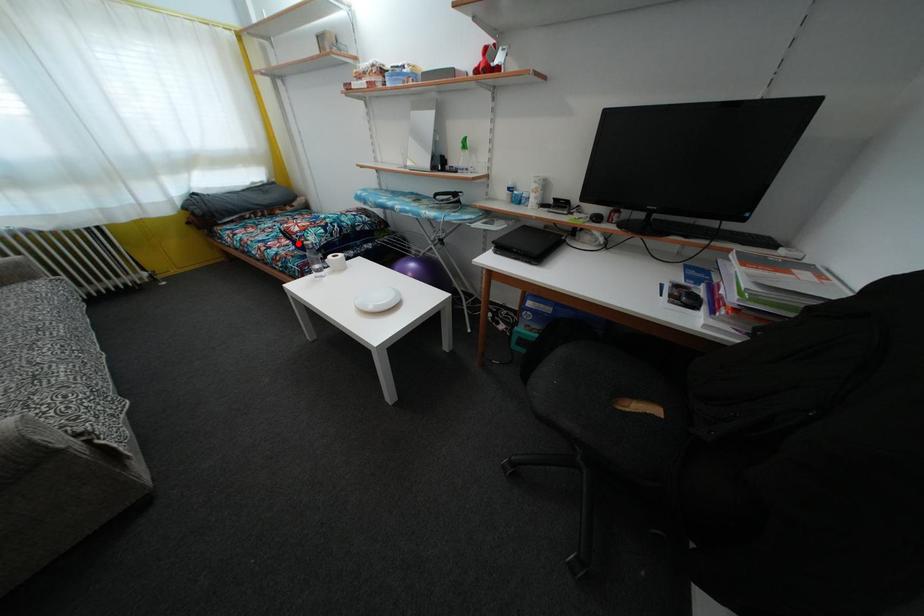
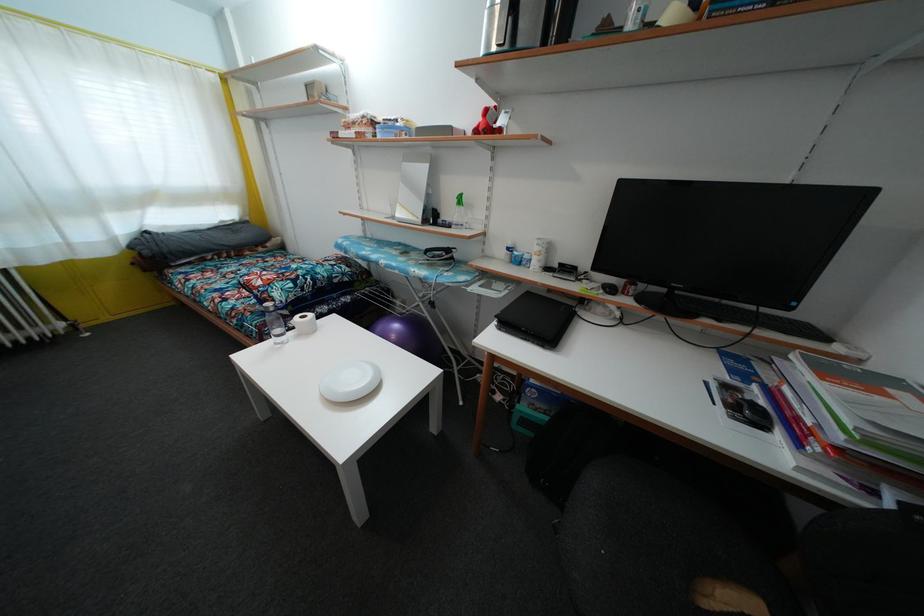
Question: A red point is marked in image1. In image2, is the corresponding 3D point closer to the camera or farther? Reply with the corresponding letter.

Choices:
 (A) The corresponding 3D point is closer.
 (B) The corresponding 3D point is farther.

Answer: (B)